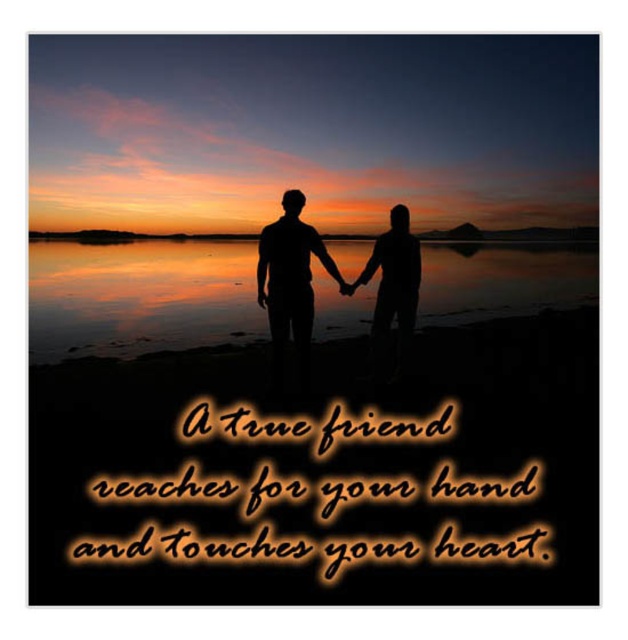
Question: Is black matte silhouette at center wider than black matte silhouette of person at center?

Choices:
 (A) no
 (B) yes

Answer: (B)

Question: Does black matte silhouette at center have a greater width compared to black matte silhouette of person at center?

Choices:
 (A) no
 (B) yes

Answer: (B)

Question: Observing the image, what is the correct spatial positioning of black matte silhouette at center in reference to black matte silhouette of person at center?

Choices:
 (A) above
 (B) below

Answer: (A)

Question: Which point is farther to the camera?

Choices:
 (A) black matte silhouette of person at center
 (B) black matte silhouette at center

Answer: (A)

Question: Among these points, which one is nearest to the camera?

Choices:
 (A) (396, 204)
 (B) (290, 241)

Answer: (B)